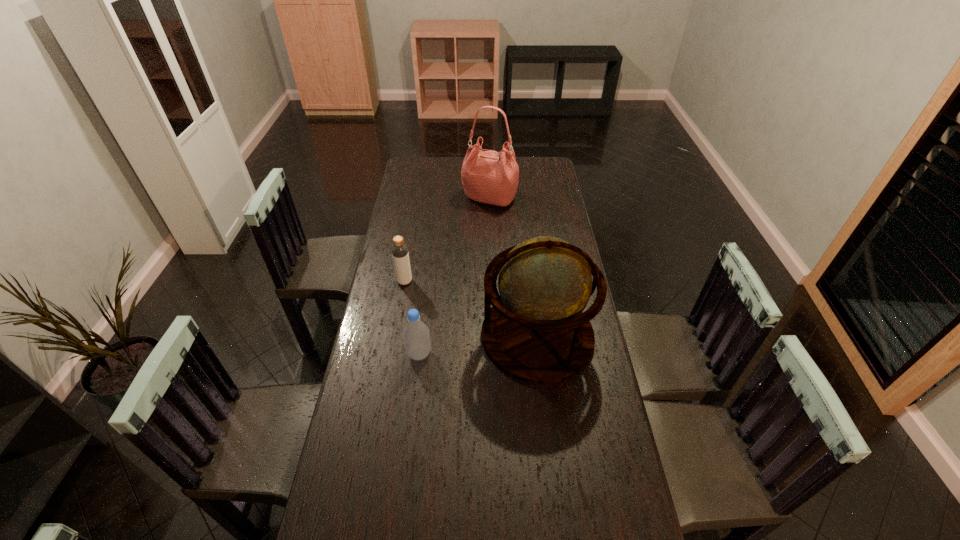
Where is `handbag`? This screenshot has height=540, width=960. handbag is located at coordinates [490, 177].

The width and height of the screenshot is (960, 540). What are the coordinates of `globe` in the screenshot? It's located at (536, 332).

Where is `the second farthest object`? Image resolution: width=960 pixels, height=540 pixels. the second farthest object is located at coordinates (400, 255).

Locate an element on the screen. This screenshot has width=960, height=540. the farther bottle is located at coordinates (400, 255).

The width and height of the screenshot is (960, 540). What are the coordinates of `the third object from right to left` in the screenshot? It's located at (416, 336).

Identify the location of the right bottle. Image resolution: width=960 pixels, height=540 pixels. (416, 336).

Identify the location of vacant space located 0.220m on the right of the handbag. This screenshot has height=540, width=960. (563, 198).

I want to click on free spot located 0.180m on the front-facing side of the globe, so [429, 336].

This screenshot has width=960, height=540. Find the location of `vacant space situated on the front-facing side of the globe`. vacant space situated on the front-facing side of the globe is located at coordinates (464, 336).

Identify the location of vacant space located on the front-facing side of the globe. This screenshot has height=540, width=960. (458, 336).